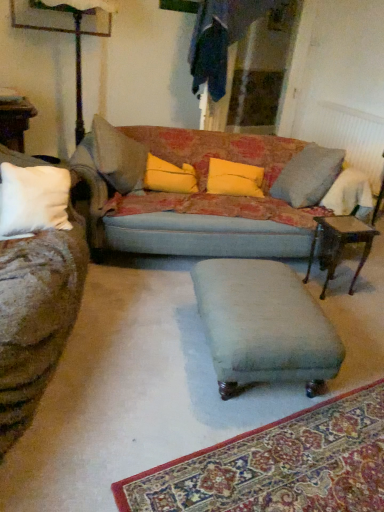
Question: Should I look upward or downward to see textured fabric couch at center?

Choices:
 (A) down
 (B) up

Answer: (B)

Question: Can you confirm if textured fabric couch at center is wider than wooden side table at right?

Choices:
 (A) no
 (B) yes

Answer: (B)

Question: Considering the relative sizes of textured fabric couch at center and wooden side table at right in the image provided, is textured fabric couch at center taller than wooden side table at right?

Choices:
 (A) yes
 (B) no

Answer: (A)

Question: Is textured fabric couch at center located outside wooden side table at right?

Choices:
 (A) no
 (B) yes

Answer: (B)

Question: From a real-world perspective, is textured fabric couch at center positioned over wooden side table at right based on gravity?

Choices:
 (A) no
 (B) yes

Answer: (B)

Question: Considering the relative positions of textured fabric couch at center and wooden side table at right in the image provided, is textured fabric couch at center in front of wooden side table at right?

Choices:
 (A) no
 (B) yes

Answer: (B)

Question: Is textured fabric couch at center looking in the opposite direction of wooden side table at right?

Choices:
 (A) no
 (B) yes

Answer: (A)

Question: Can you see velvet teal footrest at center touching yellow fabric pillow at center, placed as the 2th pillow when sorted from right to left?

Choices:
 (A) yes
 (B) no

Answer: (B)

Question: Is velvet teal footrest at center bigger than yellow fabric pillow at center, which appears as the 1th pillow when viewed from the left?

Choices:
 (A) no
 (B) yes

Answer: (B)

Question: Would you say yellow fabric pillow at center, placed as the 2th pillow when sorted from right to left, is part of velvet teal footrest at center's contents?

Choices:
 (A) no
 (B) yes

Answer: (A)

Question: Is velvet teal footrest at center oriented towards yellow fabric pillow at center, placed as the 2th pillow when sorted from right to left?

Choices:
 (A) no
 (B) yes

Answer: (A)

Question: Does velvet teal footrest at center appear on the left side of yellow fabric pillow at center, placed as the 2th pillow when sorted from right to left?

Choices:
 (A) no
 (B) yes

Answer: (A)

Question: Is velvet teal footrest at center smaller than yellow fabric pillow at center, placed as the 2th pillow when sorted from right to left?

Choices:
 (A) no
 (B) yes

Answer: (A)

Question: From the image's perspective, is velvet teal footrest at center under white textured radiator at upper right?

Choices:
 (A) yes
 (B) no

Answer: (A)